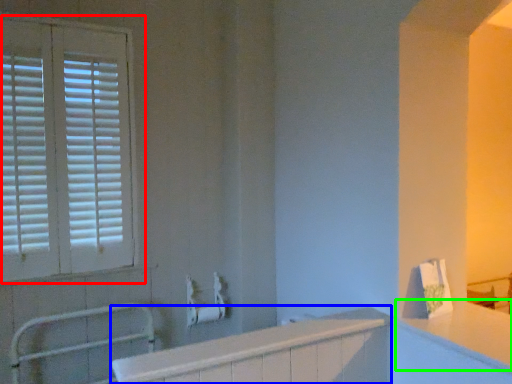
Question: Which object is the farthest from window (highlighted by a red box)? Choose among these: bath (highlighted by a blue box) or counter top (highlighted by a green box).

Choices:
 (A) bath
 (B) counter top

Answer: (B)